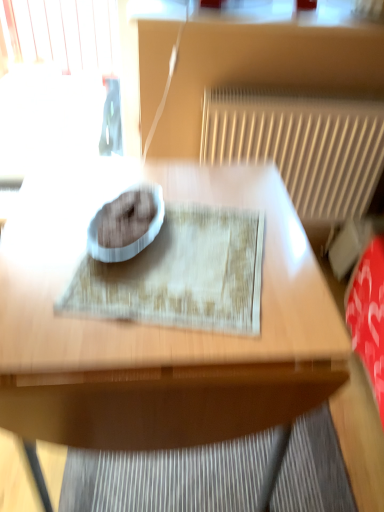
Image resolution: width=384 pixels, height=512 pixels. I want to click on textured beige mat at center, so click(x=180, y=275).

From the image's perspective, who appears lower, textured beige mat at center or white textured radiator at upper right?

textured beige mat at center, from the image's perspective.

Is textured beige mat at center situated inside white textured radiator at upper right or outside?

textured beige mat at center is not enclosed by white textured radiator at upper right.

In the scene shown: Does textured beige mat at center turn towards white textured radiator at upper right?

No, textured beige mat at center is not oriented towards white textured radiator at upper right.

Considering the relative sizes of textured beige mat at center and white textured radiator at upper right in the image provided, is textured beige mat at center shorter than white textured radiator at upper right?

Yes, textured beige mat at center is shorter than white textured radiator at upper right.

Which of these two, wooden table at center or white textured radiator at upper right, is thinner?

white textured radiator at upper right is thinner.

Is wooden table at center turned away from white textured radiator at upper right?

No, white textured radiator at upper right is not at the back of wooden table at center.

Can you tell me how much wooden table at center and white textured radiator at upper right differ in facing direction?

86.1 degrees separate the facing orientations of wooden table at center and white textured radiator at upper right.

Does wooden table at center appear on the right side of white textured radiator at upper right?

In fact, wooden table at center is to the left of white textured radiator at upper right.

Is white textured radiator at upper right next to wooden table at center?

No, white textured radiator at upper right is not beside wooden table at center.

Between point (370, 155) and point (15, 415), which one is positioned in front?

Point (15, 415)

From a real-world perspective, who is located lower, white textured radiator at upper right or wooden table at center?

wooden table at center.

Does white textured radiator at upper right have a larger size compared to wooden table at center?

No, white textured radiator at upper right is not bigger than wooden table at center.

From a real-world perspective, between textured beige mat at center and wooden table at center, who is vertically lower?

wooden table at center is physically lower.

Find the location of a particular element. Image resolution: width=384 pixels, height=512 pixels. table below the textured beige mat at center (from the image's perspective) is located at coordinates (159, 327).

Is there a large distance between textured beige mat at center and wooden table at center?

No, textured beige mat at center is not far from wooden table at center.

Consider the image. Is textured beige mat at center looking in the opposite direction of wooden table at center?

Yes, textured beige mat at center's orientation is away from wooden table at center.

From a real-world perspective, who is located higher, white textured radiator at upper right or textured beige mat at center?

From a 3D spatial view, textured beige mat at center is above.

From the image's perspective, would you say white textured radiator at upper right is positioned over textured beige mat at center?

Yes, from the image's perspective, white textured radiator at upper right is on top of textured beige mat at center.

Does point (265, 150) appear closer or farther from the camera than point (234, 276)?

Point (265, 150) is positioned farther from the camera compared to point (234, 276).

Between wooden table at center and textured beige mat at center, which one is positioned in front?

wooden table at center is closer to the camera.

Which of these two, wooden table at center or textured beige mat at center, stands shorter?

textured beige mat at center is shorter.

From a real-world perspective, relative to textured beige mat at center, is wooden table at center vertically above or below?

Clearly, from a real-world perspective, wooden table at center is below textured beige mat at center.

Image resolution: width=384 pixels, height=512 pixels. What are the coordinates of `radiator that is behind the textured beige mat at center` in the screenshot? It's located at (302, 146).

Image resolution: width=384 pixels, height=512 pixels. I want to click on table located below the white textured radiator at upper right (from the image's perspective), so click(x=159, y=327).

Looking at the image, which one is located further to white textured radiator at upper right, textured beige mat at center or wooden table at center?

The object further to white textured radiator at upper right is textured beige mat at center.

In the scene shown: Looking at the image, which one is located further to wooden table at center, textured beige mat at center or white textured radiator at upper right?

Based on the image, white textured radiator at upper right appears to be further to wooden table at center.

Based on their spatial positions, is white textured radiator at upper right or wooden table at center closer to textured beige mat at center?

wooden table at center is closer to textured beige mat at center.

When comparing their distances from textured beige mat at center, does wooden table at center or white textured radiator at upper right seem closer?

wooden table at center is closer to textured beige mat at center.

Based on their spatial positions, is white textured radiator at upper right or textured beige mat at center further from wooden table at center?

white textured radiator at upper right.

Estimate the real-world distances between objects in this image. Which object is closer to white textured radiator at upper right, wooden table at center or textured beige mat at center?

Based on the image, wooden table at center appears to be nearer to white textured radiator at upper right.

At what (x,y) coordinates should I click in order to perform the action: click on mat located between wooden table at center and white textured radiator at upper right in the depth direction. Please return your answer as a coordinate pair (x, y). The width and height of the screenshot is (384, 512). Looking at the image, I should click on (180, 275).